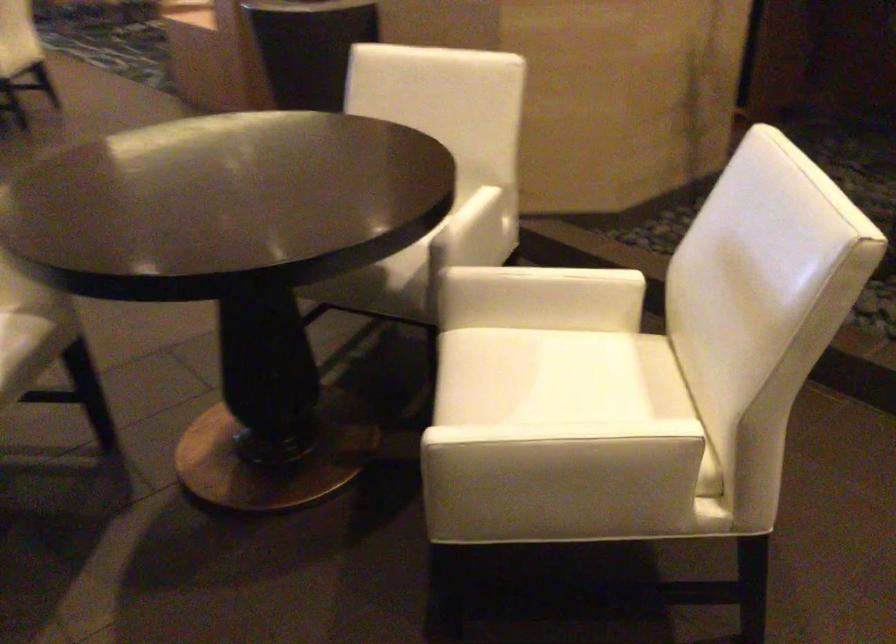
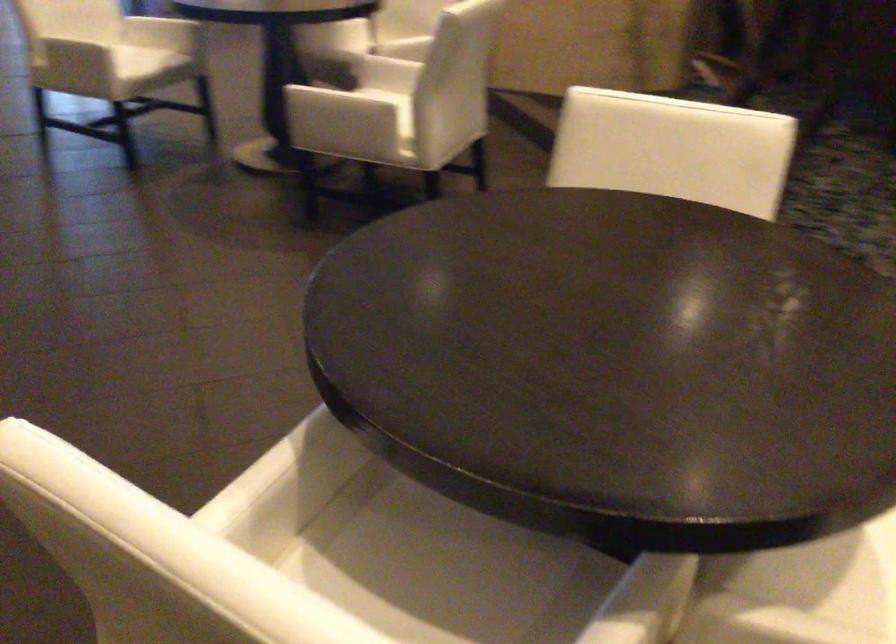
Where in the second image is the point corresponding to (x=693, y=482) from the first image?

(371, 109)